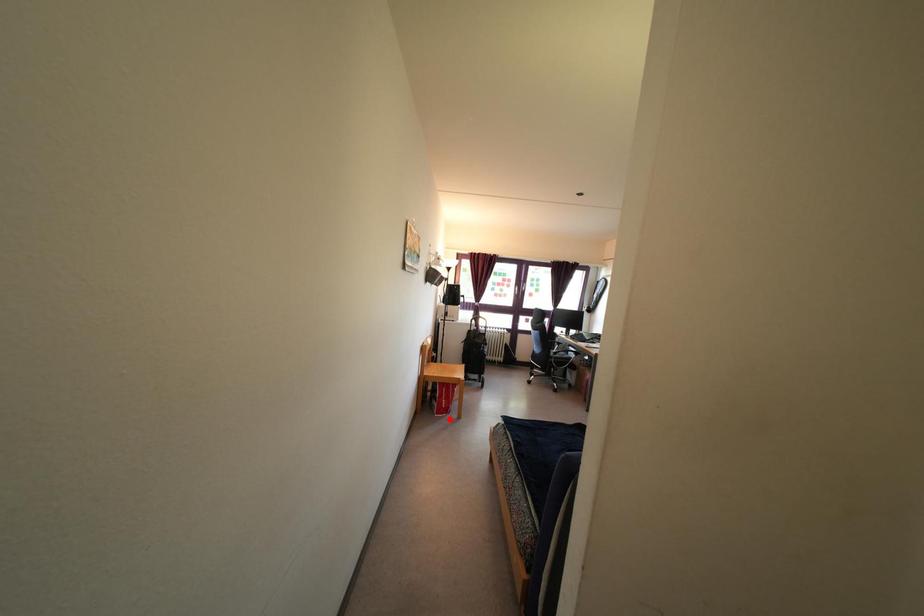
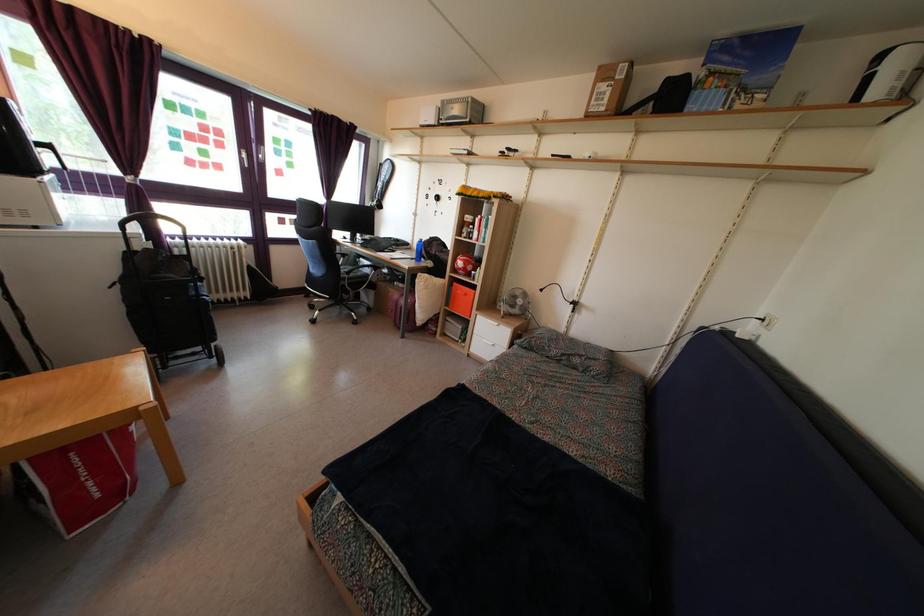
Find the pixel in the second image that matches the highlighted location in the first image.

(122, 501)